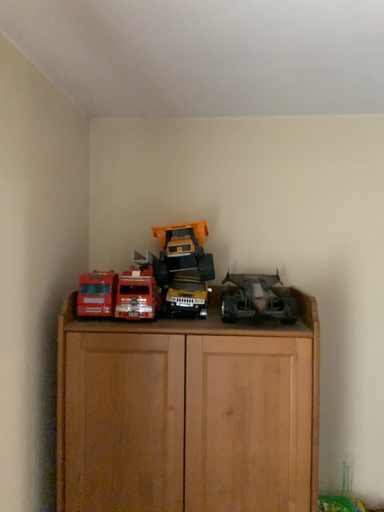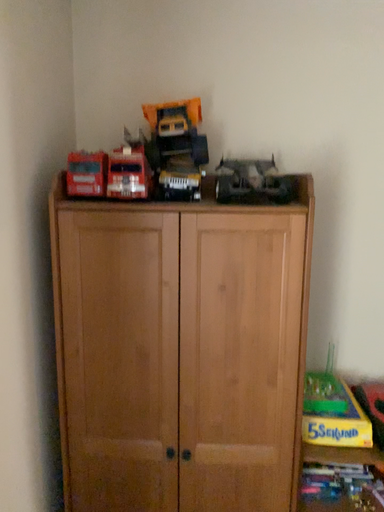
Question: Which way did the camera rotate in the video?

Choices:
 (A) rotated upward
 (B) rotated downward

Answer: (B)